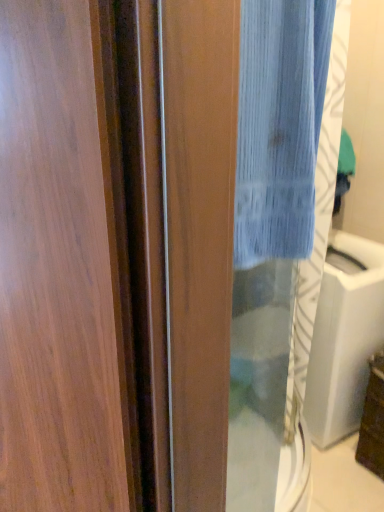
Question: From the image's perspective, is blue textured fabric at center positioned above or below wooden screen door at left?

Choices:
 (A) above
 (B) below

Answer: (A)

Question: Do you think blue textured fabric at center is within wooden screen door at left, or outside of it?

Choices:
 (A) outside
 (B) inside

Answer: (B)

Question: Estimate the real-world distances between objects in this image. Which object is farther from the transparent glass sink at center?

Choices:
 (A) wooden screen door at left
 (B) blue textured fabric at center

Answer: (B)

Question: Estimate the real-world distances between objects in this image. Which object is farther from the blue textured fabric at center?

Choices:
 (A) transparent glass sink at center
 (B) wooden screen door at left

Answer: (A)